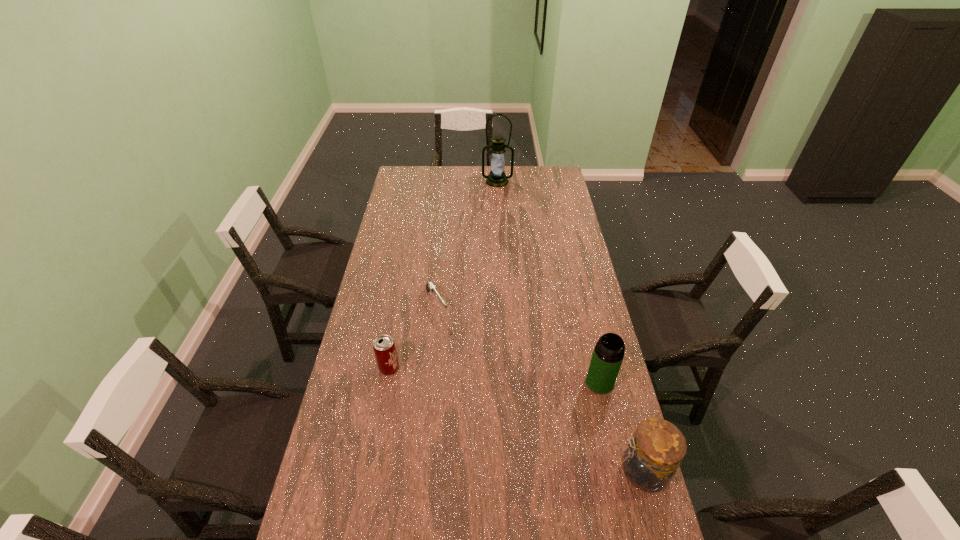
Locate an element on the screen. The width and height of the screenshot is (960, 540). vacant space located 0.300m on the side where the third object from right to left emits light is located at coordinates (496, 220).

At what (x,y) coordinates should I click in order to perform the action: click on blank area located 0.160m on the side where the third object from right to left emits light. Please return your answer as a coordinate pair (x, y). Looking at the image, I should click on (496, 204).

The height and width of the screenshot is (540, 960). I want to click on object present at the far edge, so click(497, 178).

The image size is (960, 540). Find the location of `object present at the left edge`. object present at the left edge is located at coordinates (384, 348).

Find the location of a particular element. The width and height of the screenshot is (960, 540). jar at the right edge is located at coordinates (650, 460).

The width and height of the screenshot is (960, 540). I want to click on thermos bottle that is at the right edge, so click(x=608, y=354).

Identify the location of vacant space at the far edge of the desktop. (470, 186).

Identify the location of vacant space at the near edge of the desktop. This screenshot has width=960, height=540. (476, 514).

Where is `vacant space at the left edge of the desktop`? This screenshot has width=960, height=540. vacant space at the left edge of the desktop is located at coordinates (404, 225).

Where is `vacant space at the right edge`? The height and width of the screenshot is (540, 960). vacant space at the right edge is located at coordinates (556, 209).